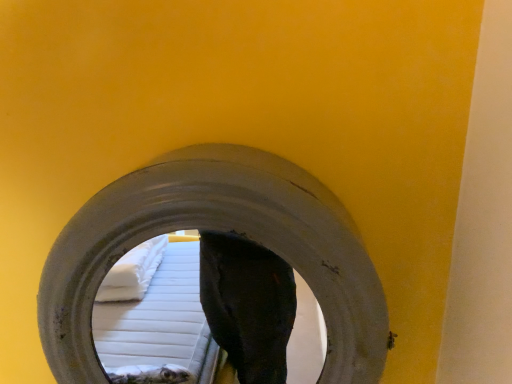
Find the location of `gray rubber tire at center`. gray rubber tire at center is located at coordinates (218, 230).

What do you see at coordinates (218, 230) in the screenshot? I see `gray rubber tire at center` at bounding box center [218, 230].

Measure the distance between gray rubber tire at center and camera.

41.32 centimeters.

This screenshot has width=512, height=384. I want to click on gray rubber tire at center, so click(x=218, y=230).